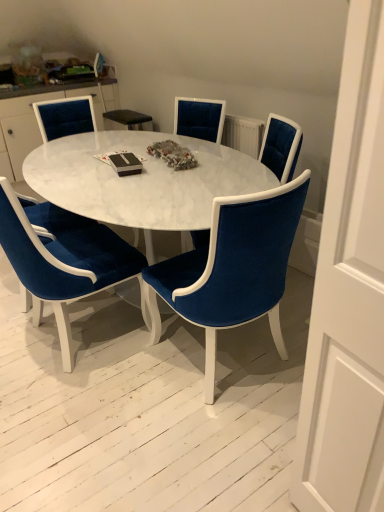
Locate an element on the screen. The width and height of the screenshot is (384, 512). velvet blue chair at upper left, which appears as the 1th chair when viewed from the left is located at coordinates (65, 117).

The height and width of the screenshot is (512, 384). Find the location of `velvet blue armchair at lower left`. velvet blue armchair at lower left is located at coordinates (17, 193).

Where is `white marble coffee table at center`? white marble coffee table at center is located at coordinates (142, 181).

Identify the location of velvet blue chair at center, which is the fourth chair in left-to-right order. The image size is (384, 512). [232, 268].

From a real-world perspective, is velvet blue chair at upper left, which appears as the 1th chair when viewed from the left, below velvet blue armchair at lower left?

Incorrect, from a real-world perspective, velvet blue chair at upper left, which appears as the 1th chair when viewed from the left, is higher than velvet blue armchair at lower left.

Which object is closer to the camera taking this photo, velvet blue chair at upper left, which is counted as the 5th chair, starting from the right, or velvet blue armchair at lower left?

velvet blue armchair at lower left.

Does velvet blue chair at upper left, which is counted as the 5th chair, starting from the right, have a greater width compared to velvet blue armchair at lower left?

In fact, velvet blue chair at upper left, which is counted as the 5th chair, starting from the right, might be narrower than velvet blue armchair at lower left.

Is velvet blue chair at upper left, which is counted as the 5th chair, starting from the right, placed right next to velvet blue armchair at lower left?

velvet blue chair at upper left, which is counted as the 5th chair, starting from the right, and velvet blue armchair at lower left are not in contact.

Would you say velvet blue chair at center, the second chair in the right-to-left sequence, is to the left or to the right of velvet blue chair at upper left, which appears as the 1th chair when viewed from the left, in the picture?

Clearly, velvet blue chair at center, the second chair in the right-to-left sequence, is on the right of velvet blue chair at upper left, which appears as the 1th chair when viewed from the left, in the image.

From a real-world perspective, is velvet blue chair at center, the second chair in the right-to-left sequence, on velvet blue chair at upper left, which appears as the 1th chair when viewed from the left?

No.

Is velvet blue chair at center, which is the fourth chair in left-to-right order, spatially inside velvet blue chair at upper left, which appears as the 1th chair when viewed from the left, or outside of it?

The correct answer is: outside.

Does velvet blue chair at center, the second chair in the right-to-left sequence, turn towards velvet blue chair at upper left, which appears as the 1th chair when viewed from the left?

Yes.

Can you confirm if velvet blue chair at center, which is the fourth chair in left-to-right order, is positioned to the left of velvet blue chair at center, which is counted as the 5th chair, starting from the left?

Yes, velvet blue chair at center, which is the fourth chair in left-to-right order, is to the left of velvet blue chair at center, which is counted as the 5th chair, starting from the left.

Looking at this image, is velvet blue chair at center, which is counted as the 5th chair, starting from the left, inside velvet blue chair at center, the second chair in the right-to-left sequence?

No, velvet blue chair at center, the second chair in the right-to-left sequence, does not contain velvet blue chair at center, which is counted as the 5th chair, starting from the left.

Are velvet blue chair at center, which is the fourth chair in left-to-right order, and velvet blue chair at center, which is counted as the 5th chair, starting from the left, beside each other?

No, velvet blue chair at center, which is the fourth chair in left-to-right order, is not next to velvet blue chair at center, which is counted as the 5th chair, starting from the left.

Which point is more forward, (x=253, y=311) or (x=203, y=245)?

The point (x=253, y=311) is closer.

I want to click on armchair below the velvet blue chair at center, the second chair in the right-to-left sequence (from a real-world perspective), so click(17, 193).

Do you think velvet blue chair at center, which is the fourth chair in left-to-right order, is within velvet blue armchair at lower left, or outside of it?

velvet blue chair at center, which is the fourth chair in left-to-right order, exists outside the volume of velvet blue armchair at lower left.

Can you confirm if velvet blue chair at center, the second chair in the right-to-left sequence, is positioned to the right of velvet blue armchair at lower left?

Yes, velvet blue chair at center, the second chair in the right-to-left sequence, is to the right of velvet blue armchair at lower left.

From the image's perspective, relative to velvet blue armchair at lower left, is velvet blue chair at center, the second chair in the right-to-left sequence, above or below?

From the image's perspective, velvet blue chair at center, the second chair in the right-to-left sequence, appears below velvet blue armchair at lower left.

From the picture: Is there a large distance between velvet blue chair at center, which ranks as the third chair in right-to-left order, and velvet blue chair at center, which is counted as the 5th chair, starting from the left?

No, there isn't a large distance between velvet blue chair at center, which ranks as the third chair in right-to-left order, and velvet blue chair at center, which is counted as the 5th chair, starting from the left.

Consider the image. In terms of width, does velvet blue chair at center, the 3th chair in the left-to-right sequence, look wider or thinner when compared to velvet blue chair at center, the first chair positioned from the right?

Considering their sizes, velvet blue chair at center, the 3th chair in the left-to-right sequence, looks broader than velvet blue chair at center, the first chair positioned from the right.

From their relative heights in the image, would you say velvet blue chair at center, which ranks as the third chair in right-to-left order, is taller or shorter than velvet blue chair at center, the first chair positioned from the right?

velvet blue chair at center, which ranks as the third chair in right-to-left order, is taller than velvet blue chair at center, the first chair positioned from the right.

Is velvet blue chair at center, which is counted as the 5th chair, starting from the left, inside velvet blue chair at center, which ranks as the third chair in right-to-left order?

No.

Identify the location of the 2nd chair above the white marble coffee table at center (from the image's perspective). This screenshot has width=384, height=512. (199, 118).

From the image's perspective, is velvet blue chair at center, which ranks as the third chair in right-to-left order, located above white marble coffee table at center?

Correct, velvet blue chair at center, which ranks as the third chair in right-to-left order, appears higher than white marble coffee table at center in the image.

From the picture: Does velvet blue chair at center, the 3th chair in the left-to-right sequence, appear on the right side of white marble coffee table at center?

Indeed, velvet blue chair at center, the 3th chair in the left-to-right sequence, is positioned on the right side of white marble coffee table at center.

Considering the sizes of velvet blue chair at center, which is counted as the 5th chair, starting from the left, and white marble coffee table at center in the image, is velvet blue chair at center, which is counted as the 5th chair, starting from the left, wider or thinner than white marble coffee table at center?

Clearly, velvet blue chair at center, which is counted as the 5th chair, starting from the left, has less width compared to white marble coffee table at center.

Between velvet blue chair at center, the first chair positioned from the right, and white marble coffee table at center, which one has less height?

Standing shorter between the two is white marble coffee table at center.

How far apart are velvet blue chair at center, which is counted as the 5th chair, starting from the left, and white marble coffee table at center?

velvet blue chair at center, which is counted as the 5th chair, starting from the left, is 23.22 inches away from white marble coffee table at center.

Are velvet blue chair at center, the first chair positioned from the right, and white marble coffee table at center beside each other?

velvet blue chair at center, the first chair positioned from the right, and white marble coffee table at center are clearly separated.

Which chair is the 2nd one when counting from the back of the velvet blue armchair at lower left? Please provide its 2D coordinates.

[(65, 117)]

Starting from the velvet blue chair at upper left, which appears as the 1th chair when viewed from the left, which chair is the 3rd one to the right? Please provide its 2D coordinates.

[(232, 268)]

Based on their spatial positions, is velvet blue chair at center, the 3th chair in the left-to-right sequence, or velvet blue armchair at lower left closer to velvet blue chair at upper left, which appears as the 1th chair when viewed from the left?

velvet blue chair at center, the 3th chair in the left-to-right sequence, lies closer to velvet blue chair at upper left, which appears as the 1th chair when viewed from the left, than the other object.

Looking at the image, which one is located closer to velvet blue chair at upper left, which is counted as the 5th chair, starting from the right, velvet blue chair at center, which is the fourth chair in left-to-right order, or velvet blue chair at center, the fourth chair when ordered from right to left?

velvet blue chair at center, the fourth chair when ordered from right to left.

When comparing their distances from velvet blue chair at center, which appears as the 2th chair when viewed from the left, does velvet blue chair at center, which is the fourth chair in left-to-right order, or white marble coffee table at center seem closer?

white marble coffee table at center lies closer to velvet blue chair at center, which appears as the 2th chair when viewed from the left, than the other object.

Considering their positions, is velvet blue chair at center, which is counted as the 5th chair, starting from the left, positioned further to velvet blue chair at upper left, which is counted as the 5th chair, starting from the right, than velvet blue chair at center, the second chair in the right-to-left sequence?

velvet blue chair at center, the second chair in the right-to-left sequence, is positioned further to the anchor velvet blue chair at upper left, which is counted as the 5th chair, starting from the right.

Which object lies further to the anchor point velvet blue chair at center, which is counted as the 5th chair, starting from the left, velvet blue chair at center, the fourth chair when ordered from right to left, or velvet blue chair at center, which is the fourth chair in left-to-right order?

velvet blue chair at center, the fourth chair when ordered from right to left.

Looking at this image, considering their positions, is velvet blue chair at center, which appears as the 2th chair when viewed from the left, positioned closer to velvet blue chair at center, the first chair positioned from the right, than velvet blue chair at center, the 3th chair in the left-to-right sequence?

velvet blue chair at center, the 3th chair in the left-to-right sequence, is closer to velvet blue chair at center, the first chair positioned from the right.

Which object lies nearer to the anchor point white marble coffee table at center, velvet blue armchair at lower left or velvet blue chair at center, which is the fourth chair in left-to-right order?

velvet blue chair at center, which is the fourth chair in left-to-right order.

When comparing their distances from velvet blue chair at center, the 3th chair in the left-to-right sequence, does white marble coffee table at center or velvet blue chair at center, which appears as the 2th chair when viewed from the left, seem closer?

The object closer to velvet blue chair at center, the 3th chair in the left-to-right sequence, is white marble coffee table at center.

The image size is (384, 512). What are the coordinates of `armchair positioned between velvet blue chair at center, the second chair in the right-to-left sequence, and velvet blue chair at upper left, which is counted as the 5th chair, starting from the right, from near to far` in the screenshot? It's located at (17, 193).

Locate an element on the screen. This screenshot has width=384, height=512. armchair between white marble coffee table at center and velvet blue chair at upper left, which appears as the 1th chair when viewed from the left, along the z-axis is located at coordinates (17, 193).

I want to click on coffee table between velvet blue chair at center, the second chair in the right-to-left sequence, and velvet blue chair at center, the first chair positioned from the right, in the front-back direction, so click(142, 181).

At what (x,y) coordinates should I click in order to perform the action: click on armchair between velvet blue chair at center, the fourth chair when ordered from right to left, and velvet blue chair at center, which ranks as the third chair in right-to-left order, along the z-axis. Please return your answer as a coordinate pair (x, y). The width and height of the screenshot is (384, 512). Looking at the image, I should click on (17, 193).